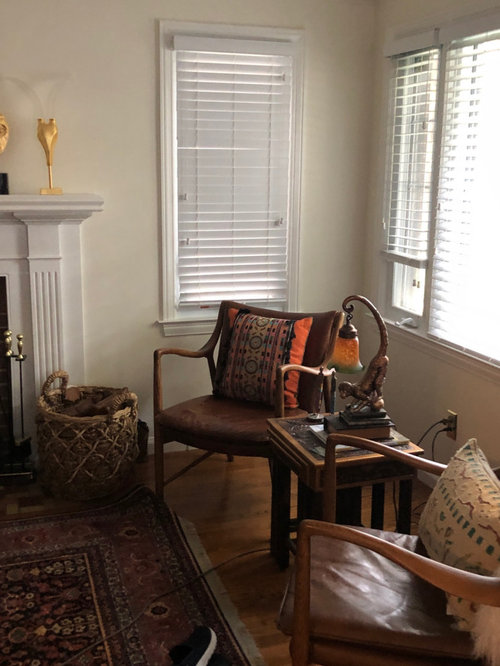
At what (x,y) coordinates should I click in order to perform the action: click on basket. Please return your answer as a coordinate pair (x, y). Image resolution: width=500 pixels, height=666 pixels. Looking at the image, I should click on (92, 466).